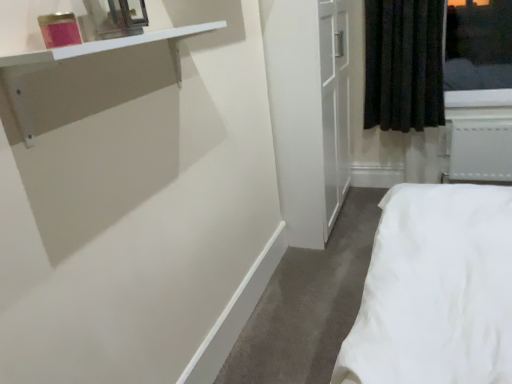
Question: Is black fabric curtain at upper right positioned behind white plastic radiator at lower right?

Choices:
 (A) no
 (B) yes

Answer: (A)

Question: Can you confirm if black fabric curtain at upper right is thinner than white plastic radiator at lower right?

Choices:
 (A) yes
 (B) no

Answer: (B)

Question: Considering the relative positions of black fabric curtain at upper right and white plastic radiator at lower right in the image provided, is black fabric curtain at upper right to the left of white plastic radiator at lower right from the viewer's perspective?

Choices:
 (A) no
 (B) yes

Answer: (B)

Question: Is black fabric curtain at upper right positioned far away from white plastic radiator at lower right?

Choices:
 (A) no
 (B) yes

Answer: (A)

Question: From the image's perspective, is black fabric curtain at upper right beneath white plastic radiator at lower right?

Choices:
 (A) no
 (B) yes

Answer: (A)

Question: Is black fabric curtain at upper right wider or thinner than metallic mirror at upper left?

Choices:
 (A) wide
 (B) thin

Answer: (A)

Question: From a real-world perspective, is black fabric curtain at upper right positioned above or below metallic mirror at upper left?

Choices:
 (A) below
 (B) above

Answer: (A)

Question: Considering their positions, is black fabric curtain at upper right located in front of or behind metallic mirror at upper left?

Choices:
 (A) behind
 (B) front

Answer: (A)

Question: Considering the positions of point (409, 99) and point (133, 16), is point (409, 99) closer or farther from the camera than point (133, 16)?

Choices:
 (A) farther
 (B) closer

Answer: (A)

Question: Considering the positions of point (105, 21) and point (492, 177), is point (105, 21) closer or farther from the camera than point (492, 177)?

Choices:
 (A) farther
 (B) closer

Answer: (B)

Question: From a real-world perspective, is metallic mirror at upper left above or below white plastic radiator at lower right?

Choices:
 (A) below
 (B) above

Answer: (B)

Question: Considering the positions of metallic mirror at upper left and white plastic radiator at lower right in the image, is metallic mirror at upper left taller or shorter than white plastic radiator at lower right?

Choices:
 (A) tall
 (B) short

Answer: (B)

Question: Is metallic mirror at upper left spatially inside white plastic radiator at lower right, or outside of it?

Choices:
 (A) outside
 (B) inside

Answer: (A)

Question: From the image's perspective, is white glossy shelf at upper left located above or below metallic mirror at upper left?

Choices:
 (A) below
 (B) above

Answer: (A)

Question: In terms of size, does white glossy shelf at upper left appear bigger or smaller than metallic mirror at upper left?

Choices:
 (A) small
 (B) big

Answer: (B)